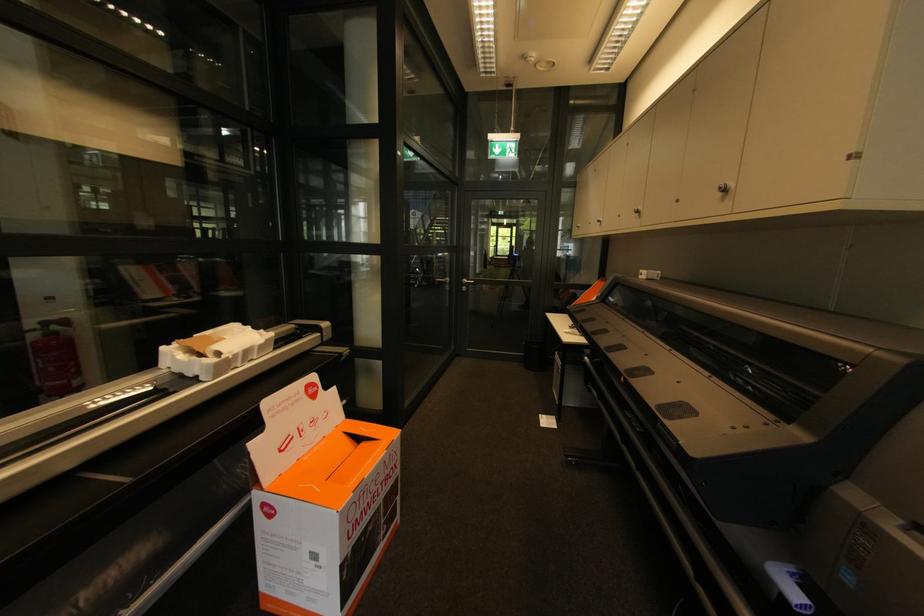
Describe the element at coordinates (723, 188) in the screenshot. I see `a metal door handle` at that location.